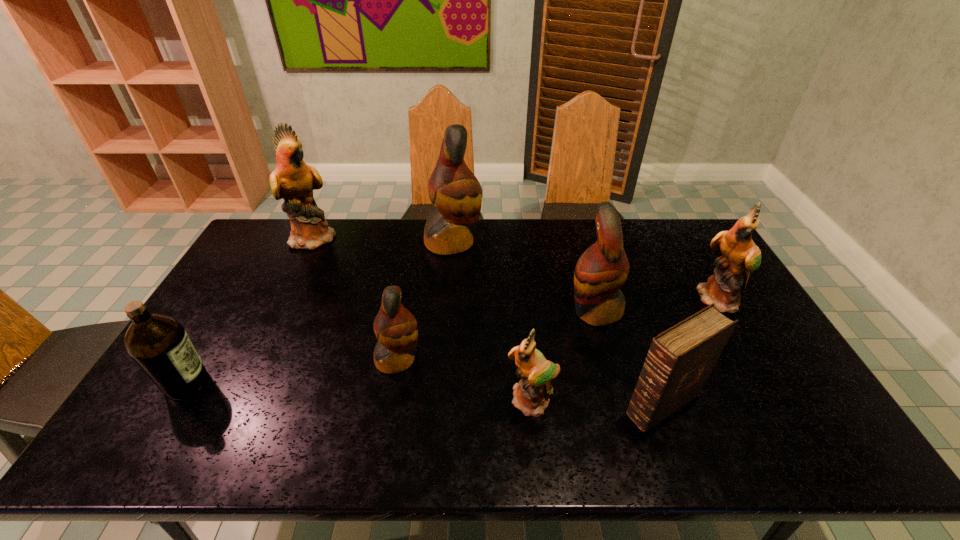
Identify the location of the seventh object from right to left. The height and width of the screenshot is (540, 960). (292, 180).

This screenshot has width=960, height=540. I want to click on the biggest green parrot, so click(x=292, y=180).

The width and height of the screenshot is (960, 540). I want to click on the farthest red parrot, so click(455, 192).

The width and height of the screenshot is (960, 540). I want to click on the rightmost red parrot, so click(603, 268).

Where is `the second smallest red parrot`? The height and width of the screenshot is (540, 960). the second smallest red parrot is located at coordinates (603, 268).

Find the location of `the rightmost green parrot`. the rightmost green parrot is located at coordinates (740, 256).

The height and width of the screenshot is (540, 960). Find the location of `the second farthest green parrot`. the second farthest green parrot is located at coordinates click(740, 256).

The width and height of the screenshot is (960, 540). What are the coordinates of `olive oil` in the screenshot? It's located at (159, 345).

Image resolution: width=960 pixels, height=540 pixels. In order to click on the leftmost object in this screenshot , I will do `click(159, 345)`.

I want to click on Bible, so click(x=680, y=359).